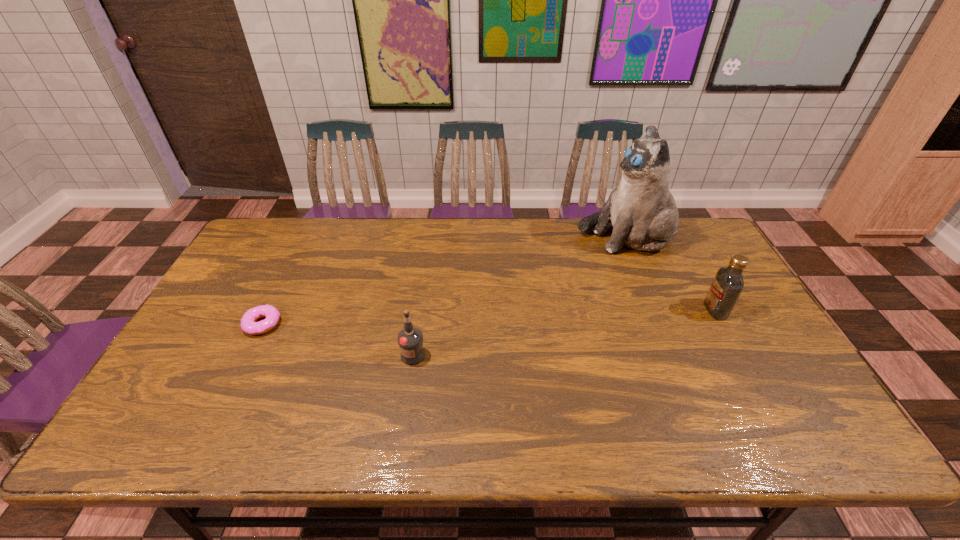
Image resolution: width=960 pixels, height=540 pixels. Identify the location of vacant space that satisfies the following two spatial constraints: 1. at the face of the farthest object; 2. on the front label of the nearest object. (673, 355).